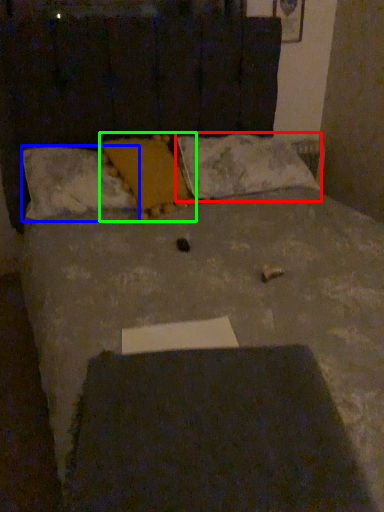
Question: Which is farther away from pillow (highlighted by a red box)? pillow (highlighted by a blue box) or pillow (highlighted by a green box)?

Choices:
 (A) pillow
 (B) pillow

Answer: (A)